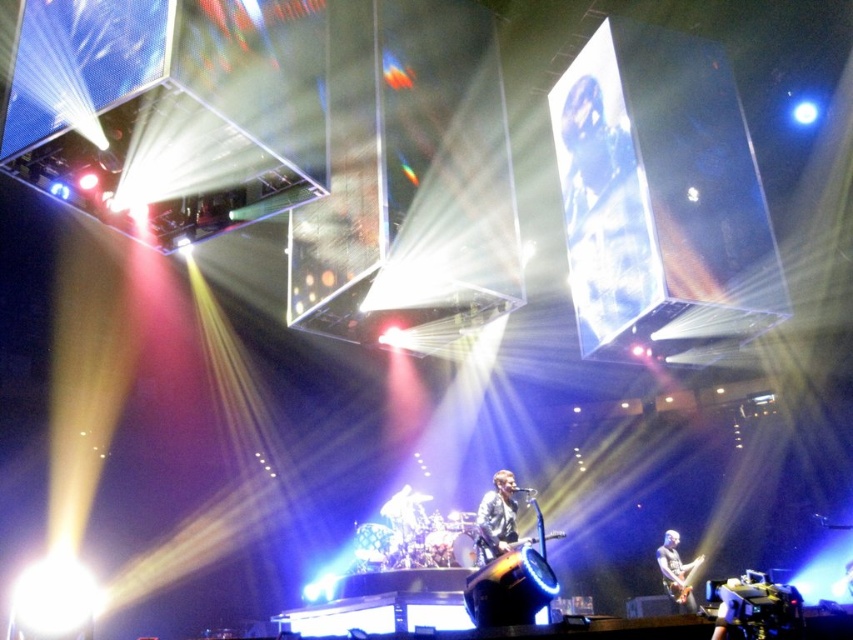
Does shiny black guitar at lower right have a lesser width compared to metallic silver guitar at lower right?

Indeed, shiny black guitar at lower right has a lesser width compared to metallic silver guitar at lower right.

Is shiny black guitar at lower right below metallic silver guitar at lower right?

Yes, shiny black guitar at lower right is below metallic silver guitar at lower right.

This screenshot has width=853, height=640. What do you see at coordinates (675, 572) in the screenshot?
I see `shiny black guitar at lower right` at bounding box center [675, 572].

Find the location of a particular element. The image size is (853, 640). shiny black guitar at lower right is located at coordinates (675, 572).

Is shiny black jacket at center to the left of metallic silver guitar at lower right from the viewer's perspective?

Indeed, shiny black jacket at center is positioned on the left side of metallic silver guitar at lower right.

Between shiny black jacket at center and metallic silver guitar at lower right, which one has less height?

Standing shorter between the two is metallic silver guitar at lower right.

Is point (495, 477) closer to viewer compared to point (689, 570)?

Yes, it is in front of point (689, 570).

You are a GUI agent. You are given a task and a screenshot of the screen. Output one action in this format:
    pyautogui.click(x=<x>, y=<y>)
    Task: Click on the shiny black jacket at center
    
    Given the screenshot: What is the action you would take?
    pyautogui.click(x=496, y=516)

Does point (498, 525) lie in front of point (665, 536)?

That is True.

What do you see at coordinates (496, 516) in the screenshot? Image resolution: width=853 pixels, height=640 pixels. I see `shiny black jacket at center` at bounding box center [496, 516].

Who is more distant from viewer, [508,536] or [670,592]?

The point [670,592] is behind.

Identify the location of shiny black jacket at center. (496, 516).